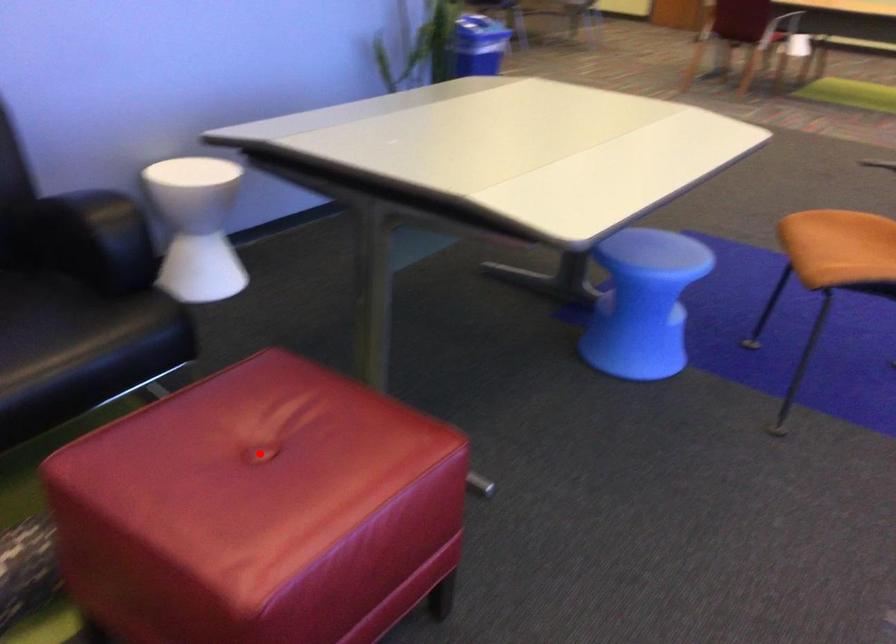
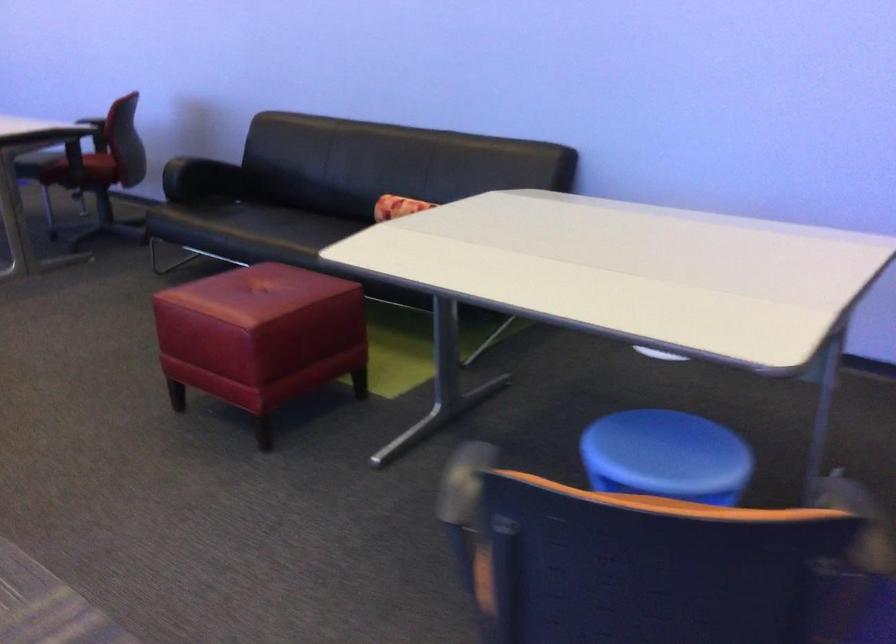
Question: I am providing you with two images of the same scene from different viewpoints. A red point is marked on the first image. Can you still see the location of the red point in image 2?

Choices:
 (A) Yes
 (B) No

Answer: (A)